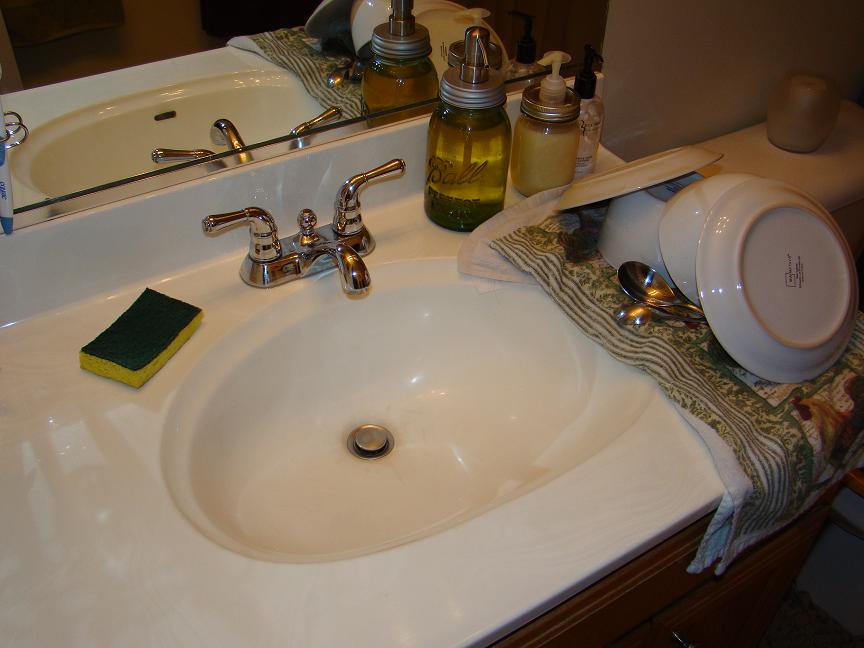
Find the location of a particular element. This screenshot has width=864, height=648. sink is located at coordinates (626, 505).